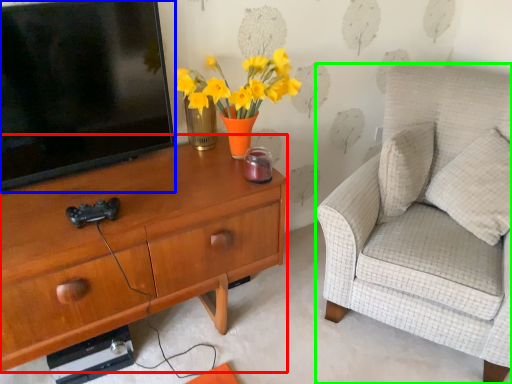
Question: Which object is the closest to the desk (highlighted by a red box)? Choose among these: television (highlighted by a blue box) or chair (highlighted by a green box).

Choices:
 (A) television
 (B) chair

Answer: (A)